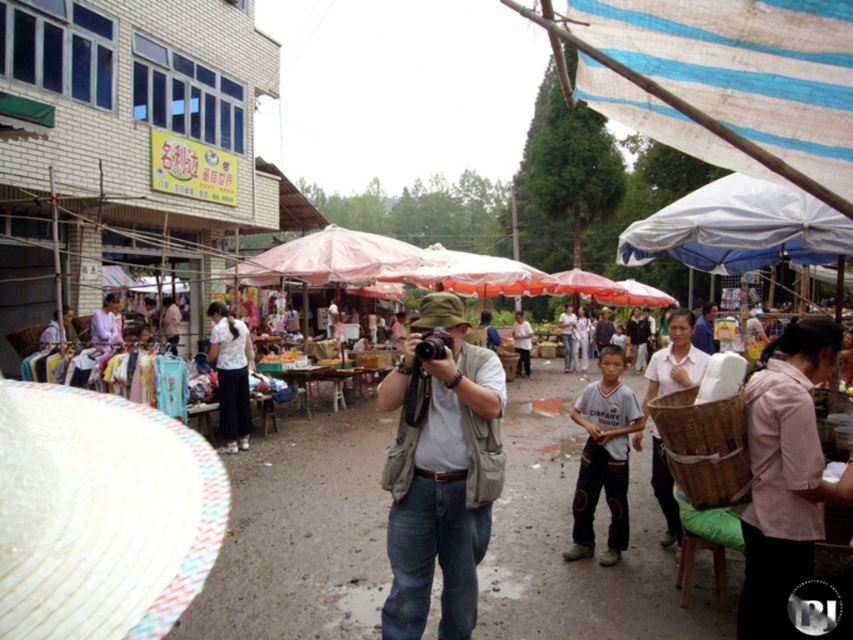
Question: Estimate the real-world distances between objects in this image. Which object is closer to the white cotton shirt at center?

Choices:
 (A) pink fabric umbrella at center
 (B) light brown cotton shirt at center
 (C) woven bamboo basket at lower right
 (D) pink striped shirt at lower right

Answer: (A)

Question: Which of these objects is positioned farthest from the white woven straw hat at lower left?

Choices:
 (A) light brown cotton shirt at center
 (B) pink striped shirt at lower right
 (C) woven bamboo basket at lower right

Answer: (A)

Question: Among these points, which one is nearest to the camera?

Choices:
 (A) (47, 611)
 (B) (317, 243)
 (C) (755, 433)

Answer: (C)

Question: Does khaki fabric vest at center come in front of light brown cotton shirt at center?

Choices:
 (A) yes
 (B) no

Answer: (A)

Question: Is pink fabric umbrella at center to the left of white cotton shirt at center from the viewer's perspective?

Choices:
 (A) yes
 (B) no

Answer: (B)

Question: Can you confirm if pink fabric umbrella at center is positioned to the right of light brown cotton shirt at center?

Choices:
 (A) yes
 (B) no

Answer: (B)